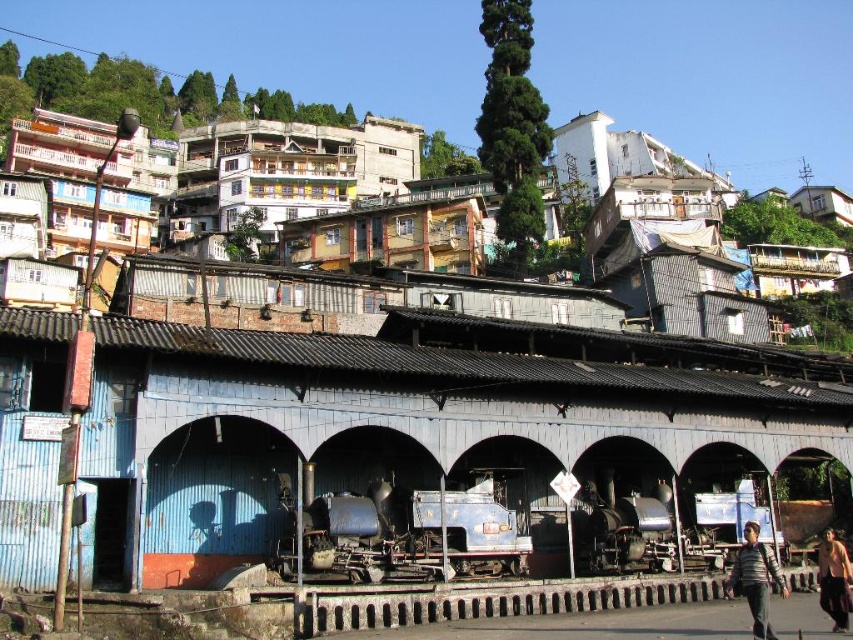
Question: Which object is positioned closest to the striped sweater at lower right?

Choices:
 (A) rustic corrugated metal train station at center
 (B) skinny man at lower right

Answer: (B)

Question: Can you confirm if rustic corrugated metal train station at center is positioned to the left of striped sweater at lower right?

Choices:
 (A) no
 (B) yes

Answer: (B)

Question: Can you confirm if rustic corrugated metal train station at center is smaller than skinny man at lower right?

Choices:
 (A) yes
 (B) no

Answer: (B)

Question: Is the position of rustic corrugated metal train station at center more distant than that of striped sweater at lower right?

Choices:
 (A) yes
 (B) no

Answer: (A)

Question: Among these objects, which one is farthest from the camera?

Choices:
 (A) striped sweater at lower right
 (B) skinny man at lower right

Answer: (B)

Question: Which of the following is the farthest from the observer?

Choices:
 (A) (753, 589)
 (B) (834, 566)

Answer: (B)